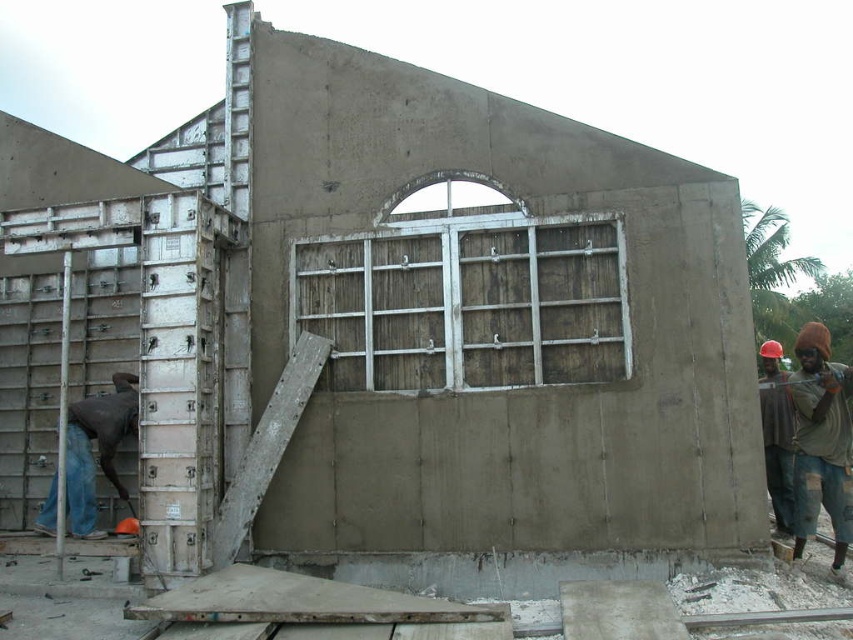
You are a safety inspector at the construction site. You notice the brown fabric cap at right and the dark blue jeans at left. According to safety protocols, hard hats must be worn at all times on site. Is the worker complying with the safety rule?

The brown fabric cap at right is positioned over dark blue jeans at left, which indicates that the worker is wearing the cap on their head. Therefore, the worker is complying with the safety rule.

You are a contractor inspecting the construction site. You notice the weathered wood window at center and the brown fabric cap at right. Which object is closer to you from your current viewpoint?

The weathered wood window at center is closer to you because it is in front of the brown fabric cap at right.